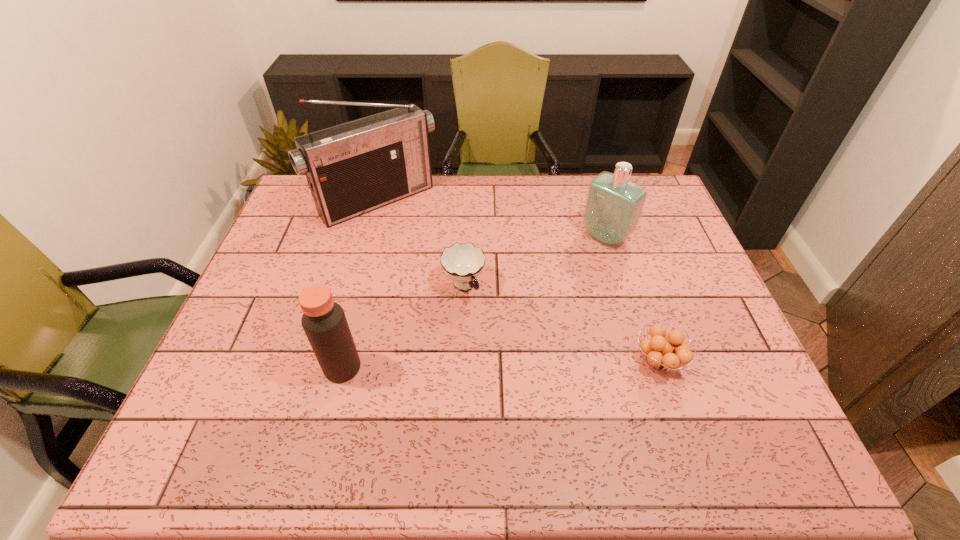
At what (x,y) coordinates should I click in order to perform the action: click on free point between the tallest object and the vinegar. Please return your answer as a coordinate pair (x, y). Looking at the image, I should click on (360, 285).

Identify the location of free space between the orange fruit and the vinegar. (500, 364).

Where is `free area in between the tallest object and the vinegar`? This screenshot has width=960, height=540. free area in between the tallest object and the vinegar is located at coordinates (360, 285).

What are the coordinates of `free space between the orange fruit and the vinegar` in the screenshot? It's located at (500, 364).

This screenshot has height=540, width=960. What are the coordinates of `free spot between the orange fruit and the third nearest object` in the screenshot? It's located at (561, 323).

Identify the location of free space between the orange fruit and the vinegar. The height and width of the screenshot is (540, 960). (500, 364).

Where is `unoccupied position between the vinegar and the orange fruit`? unoccupied position between the vinegar and the orange fruit is located at coordinates (500, 364).

Locate an element on the screen. This screenshot has width=960, height=540. empty space between the perfume and the vinegar is located at coordinates (474, 302).

Select which object is the third closest to the perfume. Please provide its 2D coordinates. Your answer should be formatted as a tuple, i.e. [(x, y)], where the tuple contains the x and y coordinates of a point satisfying the conditions above.

[(353, 168)]

Image resolution: width=960 pixels, height=540 pixels. Find the location of `object that stands as the closest to the vinegar`. object that stands as the closest to the vinegar is located at coordinates (463, 263).